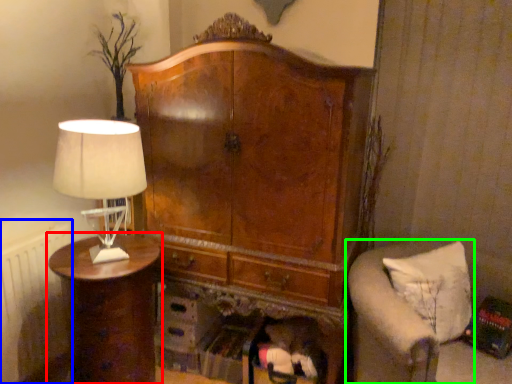
Question: Which object is positioned farthest from nightstand (highlighted by a red box)? Select from radiator (highlighted by a blue box) and furniture (highlighted by a green box).

Choices:
 (A) radiator
 (B) furniture

Answer: (B)